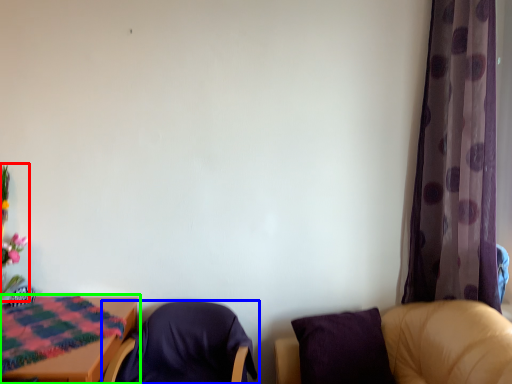
Question: Considering the real-world distances, which object is closest to floral arrangement (highlighted by a red box)? chair (highlighted by a blue box) or table (highlighted by a green box).

Choices:
 (A) chair
 (B) table

Answer: (B)